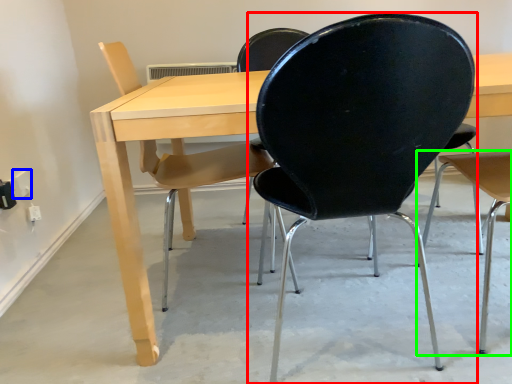
Question: Estimate the real-world distances between objects in this image. Which object is closer to chair (highlighted by a red box), electric outlet (highlighted by a blue box) or chair (highlighted by a green box)?

Choices:
 (A) electric outlet
 (B) chair

Answer: (B)